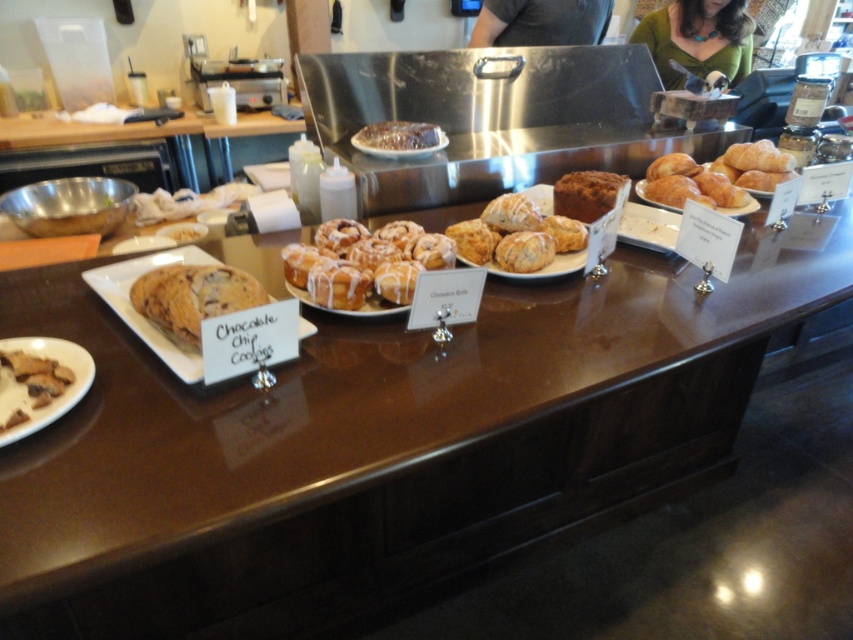
Question: Which point is closer to the camera?

Choices:
 (A) (712, 33)
 (B) (334, 291)
 (C) (403, 141)
 (D) (529, 196)

Answer: (B)

Question: Is glazed doughnut at center below chocolate chip cookies at center?

Choices:
 (A) yes
 (B) no

Answer: (B)

Question: Does green fabric shirt at upper center lie behind glazed pastry at center?

Choices:
 (A) no
 (B) yes

Answer: (B)

Question: Among these points, which one is farthest from the camera?

Choices:
 (A) (62, 390)
 (B) (610, 3)
 (C) (566, 228)
 (D) (383, 147)

Answer: (B)

Question: Can you confirm if brown crumbly cookie at lower left is positioned below dark gray shirt at upper center?

Choices:
 (A) yes
 (B) no

Answer: (A)

Question: Based on their relative distances, which object is nearer to the green fabric shirt at upper center?

Choices:
 (A) brown crumbly cookie at lower left
 (B) glazed doughnut at center
 (C) brown crumbly bread at center
 (D) chocolate chip cookies at center

Answer: (C)